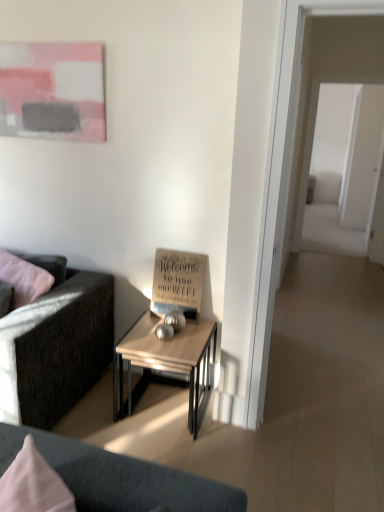
The width and height of the screenshot is (384, 512). In order to click on free space above wooden table at center (from a real-world perspective) in this screenshot , I will do `click(178, 333)`.